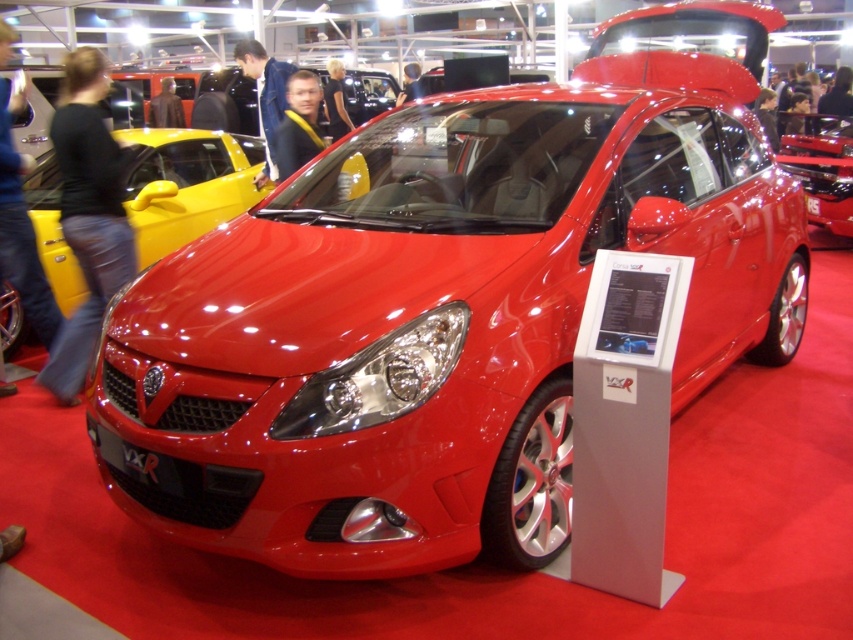
You are a photographer at the auto show and want to take a photo of the glossy yellow car at upper left and the matte black jacket at center. You need to ensure that both subjects are in focus. If your camera has a depth of field that can cover 30 inches, will you be able to capture both in focus?

The distance between the glossy yellow car at upper left and the matte black jacket at center is 31.81 inches. Since the depth of field can only cover 30 inches, the camera might not be able to keep both subjects in focus simultaneously.

You are at an auto show and see the vibrant red Vauxhall Corsa VXR on display. There is a point marked at coordinates (299, 124). What object is this point located on?

The point marked at coordinates (299, 124) is located on the matte black jacket at center.